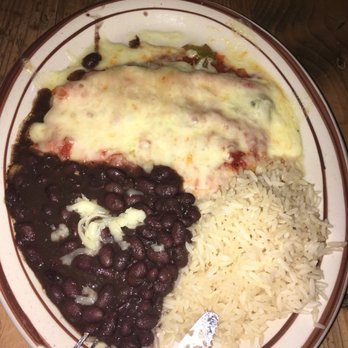
Locate an element on the screen. The width and height of the screenshot is (348, 348). wood grain is located at coordinates (292, 29).